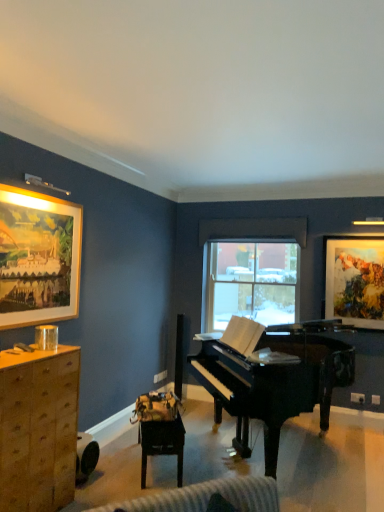
What do you see at coordinates (38, 428) in the screenshot?
I see `wooden cabinet at left` at bounding box center [38, 428].

What do you see at coordinates (273, 384) in the screenshot? The width and height of the screenshot is (384, 512). I see `glossy black piano at center` at bounding box center [273, 384].

In the scene shown: In order to face glossy black piano at center, should I rotate leftwards or rightwards?

You should rotate right by 12.189 degrees.

The image size is (384, 512). What are the coordinates of `watercolor paper painting at upper right, acting as the second picture frame starting from the left` in the screenshot? It's located at (355, 282).

Considering the positions of points (235, 335) and (36, 422), is point (235, 335) farther from camera compared to point (36, 422)?

That is True.

Does glossy black piano at center turn towards wooden cabinet at left?

Yes, glossy black piano at center is turned towards wooden cabinet at left.

I want to click on cabinetry below the glossy black piano at center (from a real-world perspective), so click(x=38, y=428).

Based on the photo, can you confirm if glossy black piano at center is thinner than wooden cabinet at left?

In fact, glossy black piano at center might be wider than wooden cabinet at left.

In the image, is watercolor paper painting at upper right, which appears as the first picture frame when viewed from the back, on the left side or the right side of glossy black piano at center?

From the image, it's evident that watercolor paper painting at upper right, which appears as the first picture frame when viewed from the back, is to the right of glossy black piano at center.

Who is more distant, watercolor paper painting at upper right, which appears as the first picture frame when viewed from the back, or glossy black piano at center?

watercolor paper painting at upper right, which appears as the first picture frame when viewed from the back, is further from the camera.

Is watercolor paper painting at upper right, positioned as the 1th picture frame in right-to-left order, not close to glossy black piano at center?

Result: watercolor paper painting at upper right, positioned as the 1th picture frame in right-to-left order, is positioned a significant distance from glossy black piano at center.

Considering the relative sizes of watercolor paper painting at upper right, which appears as the first picture frame when viewed from the back, and glossy black piano at center in the image provided, is watercolor paper painting at upper right, which appears as the first picture frame when viewed from the back, thinner than glossy black piano at center?

Indeed, watercolor paper painting at upper right, which appears as the first picture frame when viewed from the back, has a lesser width compared to glossy black piano at center.

Between wooden cabinet at left and watercolor paper painting at upper right, arranged as the second picture frame when viewed from the front, which one is positioned behind?

watercolor paper painting at upper right, arranged as the second picture frame when viewed from the front, is more distant.

Is point (74, 489) more distant than point (330, 240)?

No, it is in front of (330, 240).

Would you consider wooden cabinet at left to be distant from watercolor paper painting at upper right, arranged as the second picture frame when viewed from the front?

Yes.

Does glossy black piano at center have a lesser height compared to wooden table at center?

In fact, glossy black piano at center may be taller than wooden table at center.

How different are the orientations of glossy black piano at center and wooden table at center in degrees?

They differ by 174 degrees in their facing directions.

In the image, is glossy black piano at center positioned in front of or behind wooden table at center?

Clearly, glossy black piano at center is in front of wooden table at center.

Which of these two, glossy black piano at center or wooden table at center, is wider?

Wider between the two is glossy black piano at center.

Does point (146, 423) come farther from viewer compared to point (309, 384)?

No, it is not.

From the image's perspective, is wooden table at center beneath glossy black piano at center?

Indeed, from the image's perspective, wooden table at center is shown beneath glossy black piano at center.

Is wooden table at center facing away from glossy black piano at center?

No.

How distant is wooden table at center from glossy black piano at center?

The distance of wooden table at center from glossy black piano at center is 38.11 inches.

From the picture: Is wooden framed painting at upper left, which appears as the first picture frame when viewed from the left, placed right next to watercolor paper painting at upper right, arranged as the second picture frame when viewed from the front?

No, wooden framed painting at upper left, which appears as the first picture frame when viewed from the left, is not with watercolor paper painting at upper right, arranged as the second picture frame when viewed from the front.

Does wooden framed painting at upper left, which appears as the first picture frame when viewed from the left, come behind watercolor paper painting at upper right, which appears as the first picture frame when viewed from the back?

No, wooden framed painting at upper left, which appears as the first picture frame when viewed from the left, is closer to the camera.

Consider the image. Can you confirm if wooden framed painting at upper left, which is the second picture frame from right to left, is positioned to the left of watercolor paper painting at upper right, acting as the second picture frame starting from the left?

Correct, you'll find wooden framed painting at upper left, which is the second picture frame from right to left, to the left of watercolor paper painting at upper right, acting as the second picture frame starting from the left.

Considering the points (48, 437) and (177, 478), which point is behind, point (48, 437) or point (177, 478)?

The point (177, 478) is farther from the camera.

Considering the relative sizes of wooden cabinet at left and wooden table at center in the image provided, is wooden cabinet at left bigger than wooden table at center?

Yes.

Which object is more forward, wooden cabinet at left or wooden table at center?

wooden cabinet at left is closer to the camera.

Identify the location of piano that is on the right side of wooden cabinet at left. Image resolution: width=384 pixels, height=512 pixels. (273, 384).

Identify the location of the 1st picture frame above the glossy black piano at center (from the image's perspective). (355, 282).

Estimate the real-world distances between objects in this image. Which object is closer to watercolor paper painting at upper right, positioned as the 1th picture frame in right-to-left order, wooden cabinet at left or wooden framed painting at upper left, acting as the second picture frame starting from the back?

Among the two, wooden framed painting at upper left, acting as the second picture frame starting from the back, is located nearer to watercolor paper painting at upper right, positioned as the 1th picture frame in right-to-left order.

Estimate the real-world distances between objects in this image. Which object is closer to watercolor paper painting at upper right, acting as the second picture frame starting from the left, wooden cabinet at left or wooden table at center?

wooden table at center is positioned closer to the anchor watercolor paper painting at upper right, acting as the second picture frame starting from the left.

Looking at the image, which one is located closer to wooden table at center, wooden framed painting at upper left, acting as the second picture frame starting from the back, or wooden cabinet at left?

The object closer to wooden table at center is wooden cabinet at left.

Estimate the real-world distances between objects in this image. Which object is further from wooden framed painting at upper left, the first picture frame positioned from the front, glossy black piano at center or wooden table at center?

Among the two, glossy black piano at center is located further to wooden framed painting at upper left, the first picture frame positioned from the front.

Looking at the image, which one is located closer to wooden framed painting at upper left, the first picture frame positioned from the front, watercolor paper painting at upper right, acting as the second picture frame starting from the left, or wooden table at center?

wooden table at center lies closer to wooden framed painting at upper left, the first picture frame positioned from the front, than the other object.

Looking at the image, which one is located further to wooden framed painting at upper left, acting as the second picture frame starting from the back, watercolor paper painting at upper right, which appears as the first picture frame when viewed from the back, or wooden cabinet at left?

The object further to wooden framed painting at upper left, acting as the second picture frame starting from the back, is watercolor paper painting at upper right, which appears as the first picture frame when viewed from the back.

Which object lies further to the anchor point glossy black piano at center, wooden cabinet at left or wooden table at center?

wooden cabinet at left is positioned further to the anchor glossy black piano at center.

When comparing their distances from wooden framed painting at upper left, which is the second picture frame from right to left, does glossy black piano at center or watercolor paper painting at upper right, arranged as the second picture frame when viewed from the front, seem further?

watercolor paper painting at upper right, arranged as the second picture frame when viewed from the front.

I want to click on table situated between wooden cabinet at left and glossy black piano at center from left to right, so click(162, 443).

Identify the location of cabinetry located between wooden framed painting at upper left, which appears as the first picture frame when viewed from the left, and watercolor paper painting at upper right, acting as the second picture frame starting from the left, in the left-right direction. The image size is (384, 512). (38, 428).

Where is `table between wooden framed painting at upper left, which appears as the first picture frame when viewed from the left, and glossy black piano at center from left to right`? table between wooden framed painting at upper left, which appears as the first picture frame when viewed from the left, and glossy black piano at center from left to right is located at coordinates (162, 443).

You are a GUI agent. You are given a task and a screenshot of the screen. Output one action in this format:
    pyautogui.click(x=<x>, y=<y>)
    Task: Click on the table between wooden cabinet at left and watercolor paper painting at upper right, acting as the second picture frame starting from the left, in the horizontal direction
    Image resolution: width=384 pixels, height=512 pixels.
    Given the screenshot: What is the action you would take?
    click(x=162, y=443)